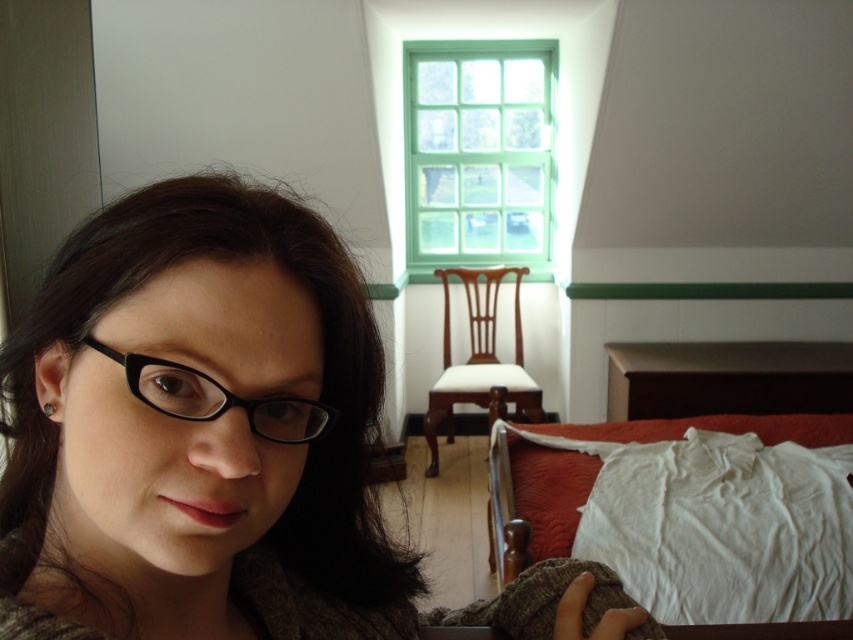
Who is taller, green painted wood window at upper center or white cotton bed at lower right?

Standing taller between the two is green painted wood window at upper center.

Where is `green painted wood window at upper center`? The width and height of the screenshot is (853, 640). green painted wood window at upper center is located at coordinates (479, 150).

Which is more to the left, white cotton bed at lower right or black plastic glasses at left?

black plastic glasses at left

The height and width of the screenshot is (640, 853). I want to click on white cotton bed at lower right, so click(x=534, y=497).

Is point (534, 497) positioned before point (144, 392)?

No, it is not.

The width and height of the screenshot is (853, 640). I want to click on white cotton bed at lower right, so click(534, 497).

Is matte black glasses at left thinner than green painted wood window at upper center?

Correct, matte black glasses at left's width is less than green painted wood window at upper center's.

This screenshot has width=853, height=640. Identify the location of matte black glasses at left. (198, 428).